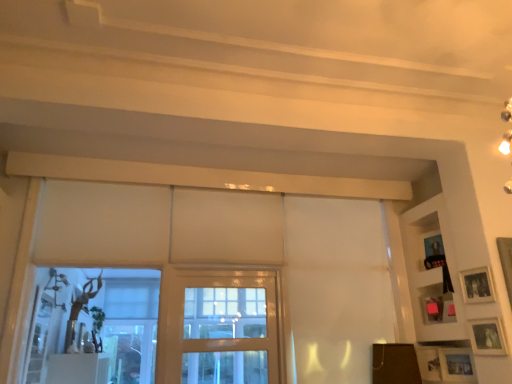
Question: Can you confirm if pink matte picture frame at right, the 2th picture frame positioned from the top, is shorter than clear glass screen door at center?

Choices:
 (A) no
 (B) yes

Answer: (B)

Question: Considering the relative positions of pink matte picture frame at right, the 2th picture frame positioned from the top, and clear glass screen door at center in the image provided, is pink matte picture frame at right, the 2th picture frame positioned from the top, to the left of clear glass screen door at center from the viewer's perspective?

Choices:
 (A) yes
 (B) no

Answer: (B)

Question: Is pink matte picture frame at right, acting as the third picture frame starting from the bottom, smaller than clear glass screen door at center?

Choices:
 (A) yes
 (B) no

Answer: (A)

Question: Does pink matte picture frame at right, acting as the third picture frame starting from the bottom, have a lesser width compared to clear glass screen door at center?

Choices:
 (A) yes
 (B) no

Answer: (A)

Question: Is pink matte picture frame at right, acting as the third picture frame starting from the bottom, looking in the opposite direction of clear glass screen door at center?

Choices:
 (A) no
 (B) yes

Answer: (A)

Question: From the image's perspective, relative to wooden shelf at upper right, is matte silver picture frame at lower right, the 4th picture frame positioned from the top, above or below?

Choices:
 (A) above
 (B) below

Answer: (B)

Question: Would you say matte silver picture frame at lower right, the 4th picture frame positioned from the top, is to the left or to the right of wooden shelf at upper right in the picture?

Choices:
 (A) right
 (B) left

Answer: (A)

Question: Considering the positions of matte silver picture frame at lower right, the 4th picture frame positioned from the top, and wooden shelf at upper right in the image, is matte silver picture frame at lower right, the 4th picture frame positioned from the top, taller or shorter than wooden shelf at upper right?

Choices:
 (A) tall
 (B) short

Answer: (B)

Question: From a real-world perspective, relative to wooden shelf at upper right, is matte silver picture frame at lower right, the 1th picture frame in the bottom-to-top sequence, vertically above or below?

Choices:
 (A) below
 (B) above

Answer: (A)

Question: Is wooden shelf at upper right inside the boundaries of clear glass screen door at center, or outside?

Choices:
 (A) inside
 (B) outside

Answer: (B)

Question: In terms of width, does wooden shelf at upper right look wider or thinner when compared to clear glass screen door at center?

Choices:
 (A) wide
 (B) thin

Answer: (A)

Question: Visually, is wooden shelf at upper right positioned to the left or to the right of clear glass screen door at center?

Choices:
 (A) left
 (B) right

Answer: (B)

Question: Considering the positions of wooden shelf at upper right and clear glass screen door at center in the image, is wooden shelf at upper right bigger or smaller than clear glass screen door at center?

Choices:
 (A) small
 (B) big

Answer: (B)

Question: Is point (404, 258) closer or farther from the camera than point (464, 294)?

Choices:
 (A) closer
 (B) farther

Answer: (B)

Question: Is wooden shelf at upper right spatially inside matte black picture frame at upper right, acting as the fourth picture frame starting from the bottom, or outside of it?

Choices:
 (A) outside
 (B) inside

Answer: (A)